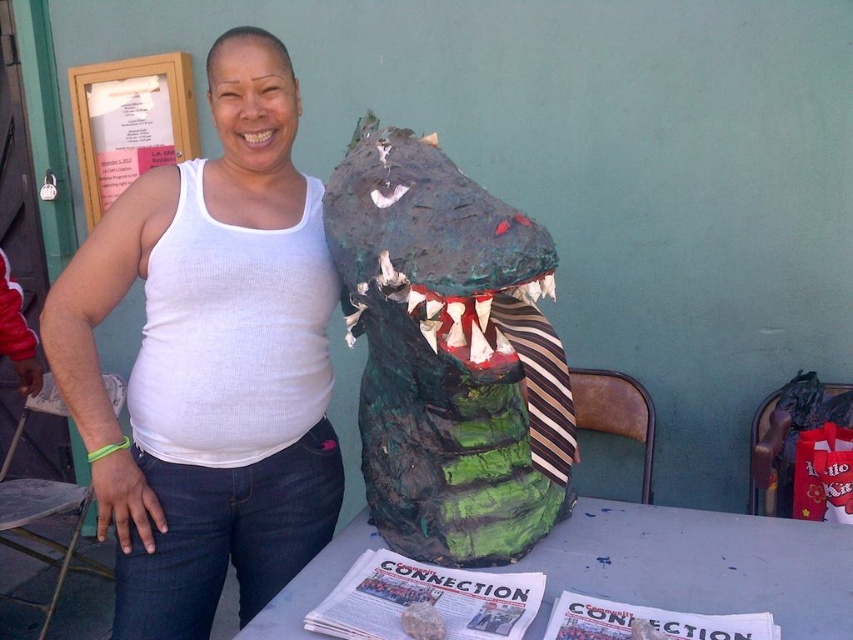
Question: Which point is closer to the camera?

Choices:
 (A) (735, 589)
 (B) (436, 164)

Answer: (A)

Question: Does white fabric tank top at center appear under green papier-mâché crocodile at center?

Choices:
 (A) yes
 (B) no

Answer: (A)

Question: Is white fabric tank top at center positioned behind wooden frame at upper left?

Choices:
 (A) no
 (B) yes

Answer: (A)

Question: Among these objects, which one is farthest from the camera?

Choices:
 (A) white paper at center
 (B) wooden frame at upper left
 (C) green papier-mâché crocodile at center
 (D) white fabric tank top at center

Answer: (B)

Question: Does green papier-mâché crocodile at center have a lesser width compared to wooden frame at upper left?

Choices:
 (A) no
 (B) yes

Answer: (B)

Question: Which object is positioned closest to the wooden frame at upper left?

Choices:
 (A) white paper at center
 (B) white fabric tank top at center

Answer: (B)